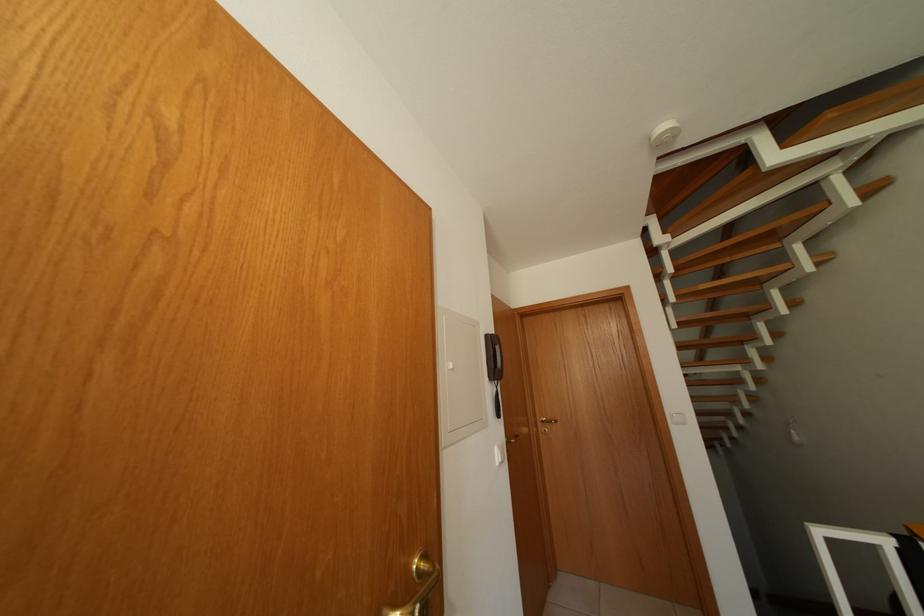
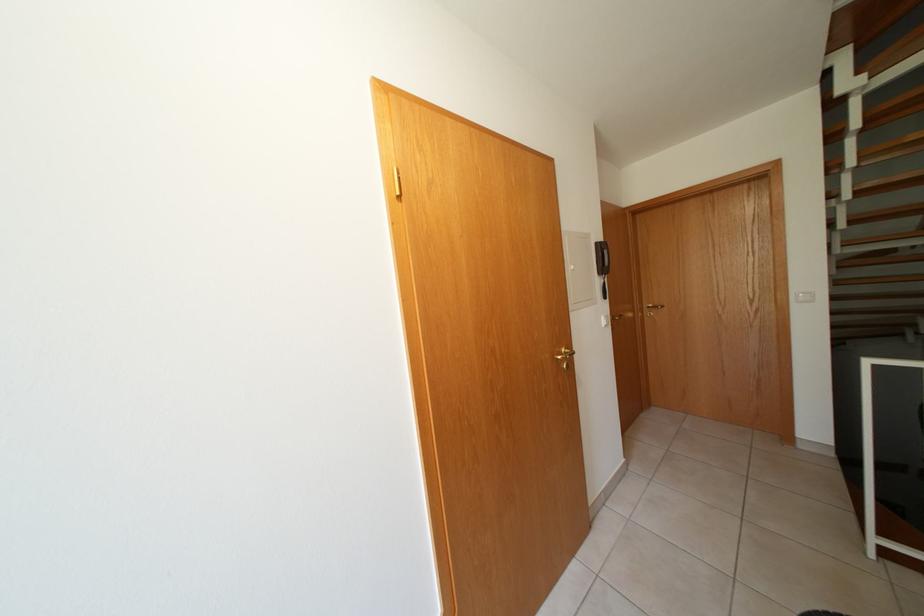
Where in the second image is the point corresponding to (x=496, y=395) from the first image?

(606, 286)